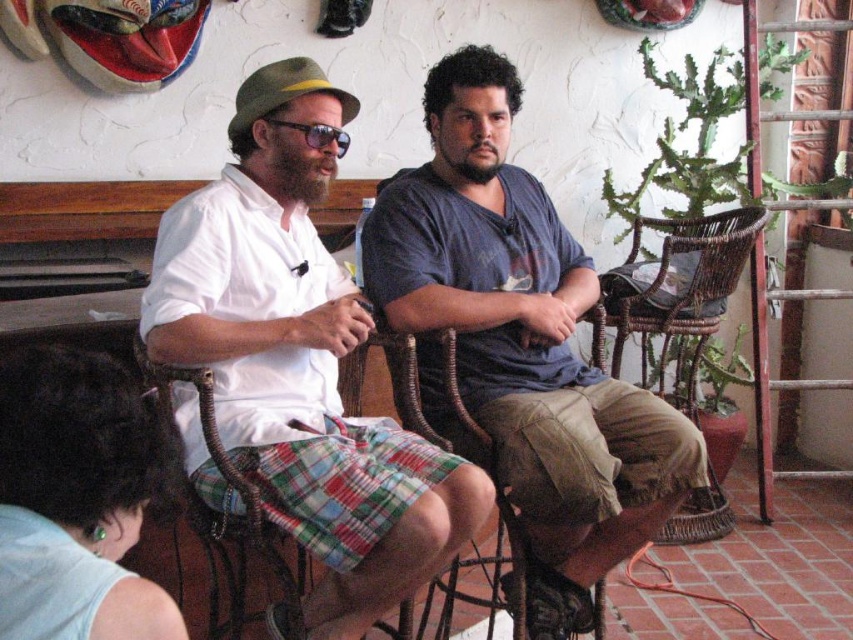
You are a delivery robot standing in the room and need to deliver a package to the person wearing the white cotton shirt at center. The robot has an arm that can reach 1.5 meters. Can the robot reach the person without moving closer?

The white cotton shirt at center is 1.47 meters away from the viewer, so the robot can reach them since its arm can extend 1.5 meters.

You are designing a storage box for the green plaid shorts at lower left and the matte plastic sunglasses at center. The box must fit both items snugly. Which item determines the minimum width of the box?

The green plaid shorts at lower left might be wider than matte plastic sunglasses at center, so the box must be at least as wide as the green plaid shorts at lower left to accommodate both items.

You are standing in the room and see two people sitting on wicker chairs. The person on the left is wearing a white short sleeved shirt and the person on the right is wearing a blue T shirt. There is a point labeled as point (300, 362). Which person is closer to this point?

The point (300, 362) corresponds to the white cotton shirt at center, so the person on the left wearing the white short sleeved shirt is closer to this point.